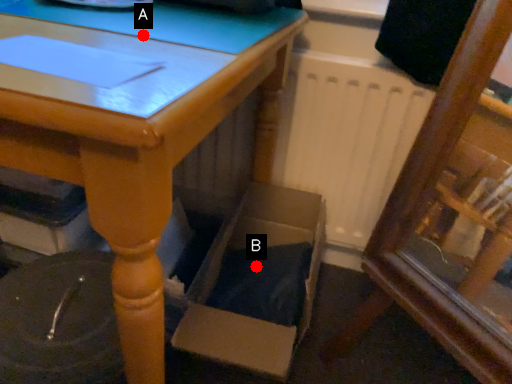
Question: Two points are circled on the image, labeled by A and B beside each circle. Among these points, which one is farthest from the camera?

Choices:
 (A) A is further
 (B) B is further

Answer: (B)